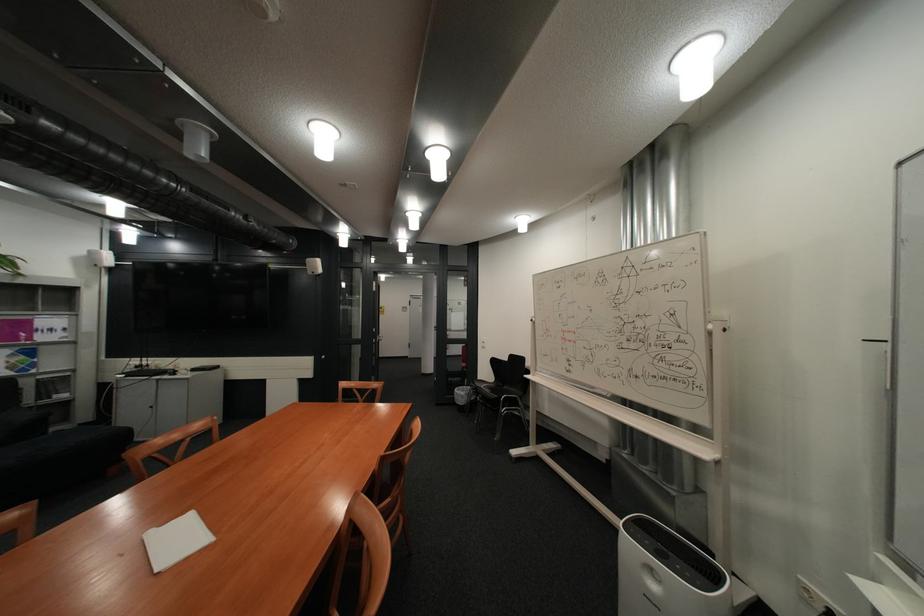
What are the coordinates of `whiteboard locking knob` in the screenshot? It's located at (715, 323).